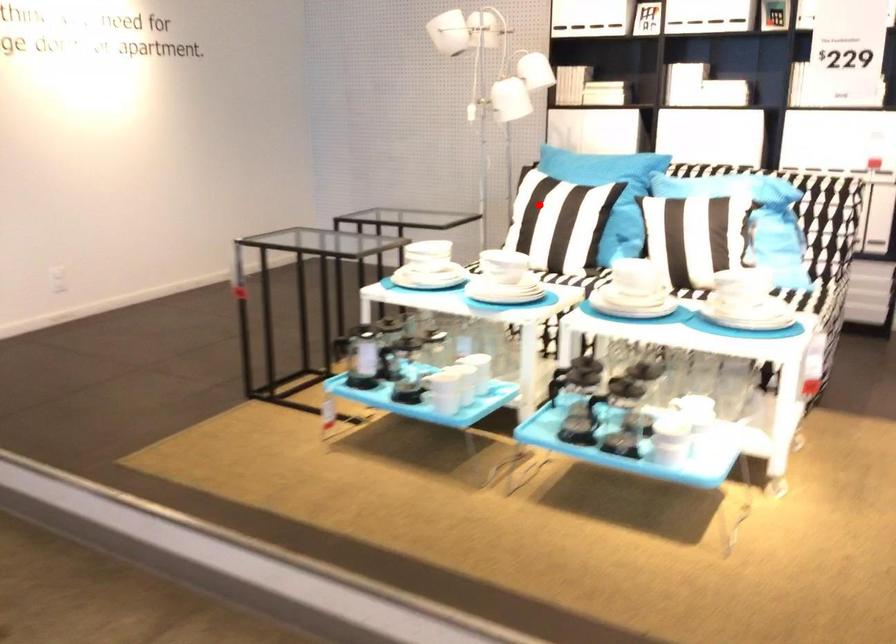
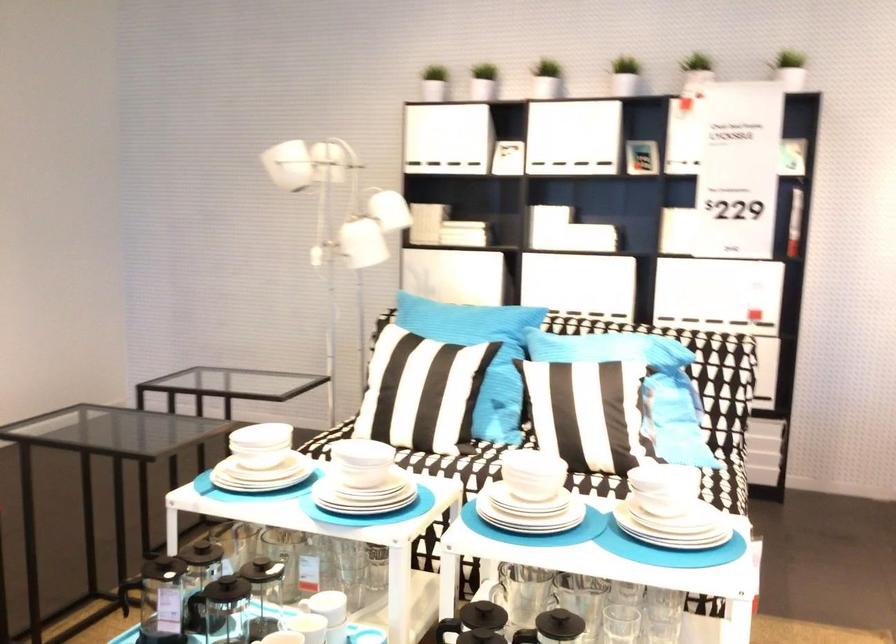
Question: I am providing you with two images of the same scene from different viewpoints. Given a red point in image1, look at the same physical point in image2. Is it:

Choices:
 (A) Closer to the viewpoint
 (B) Farther from the viewpoint

Answer: (A)